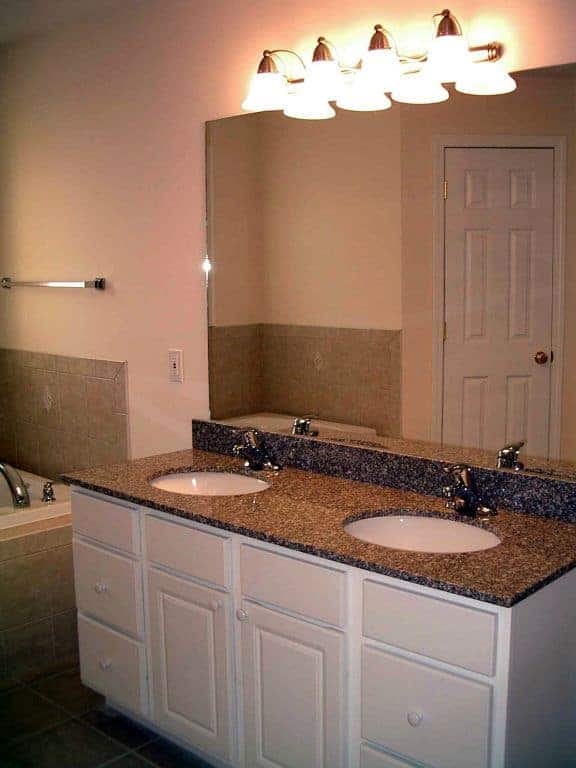
Image resolution: width=576 pixels, height=768 pixels. I want to click on tub faucet, so click(18, 490).